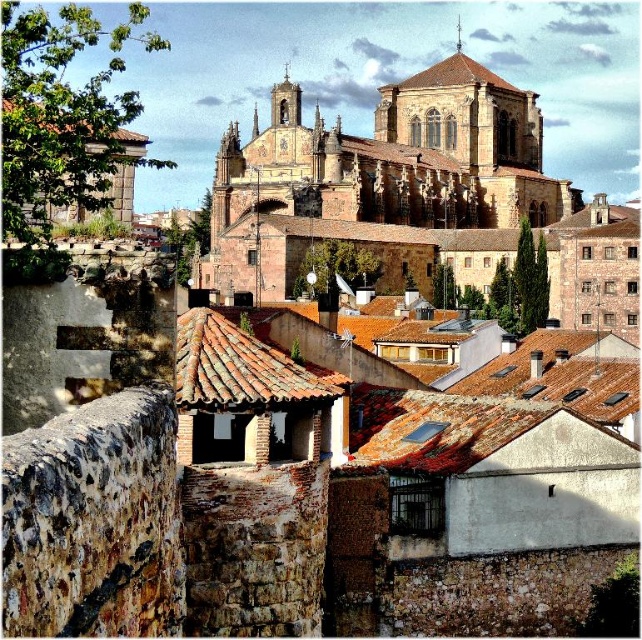
Which is in front, point (186, 326) or point (404, 84)?

Point (186, 326)

Does terracotta tiled roof at center appear over brown tiled roof at upper center?

No.

Find the location of a particular element. This screenshot has width=642, height=640. terracotta tiled roof at center is located at coordinates (236, 365).

Does brown stone church at center have a greater width compared to brown tiled roof at upper center?

Yes.

Is brown stone church at center taller than brown tiled roof at upper center?

Correct, brown stone church at center is much taller as brown tiled roof at upper center.

Which is in front, point (272, 269) or point (455, 60)?

Point (272, 269) is more forward.

Locate an element on the screen. The height and width of the screenshot is (640, 642). brown stone church at center is located at coordinates (377, 177).

Looking at this image, can you confirm if brown stone church at center is positioned to the left of terracotta tiled roof at center?

Incorrect, brown stone church at center is not on the left side of terracotta tiled roof at center.

Can you confirm if brown stone church at center is positioned above terracotta tiled roof at center?

Yes.

Does point (490, 148) come in front of point (229, 352)?

That is False.

The height and width of the screenshot is (640, 642). In order to click on brown stone church at center in this screenshot , I will do `click(377, 177)`.